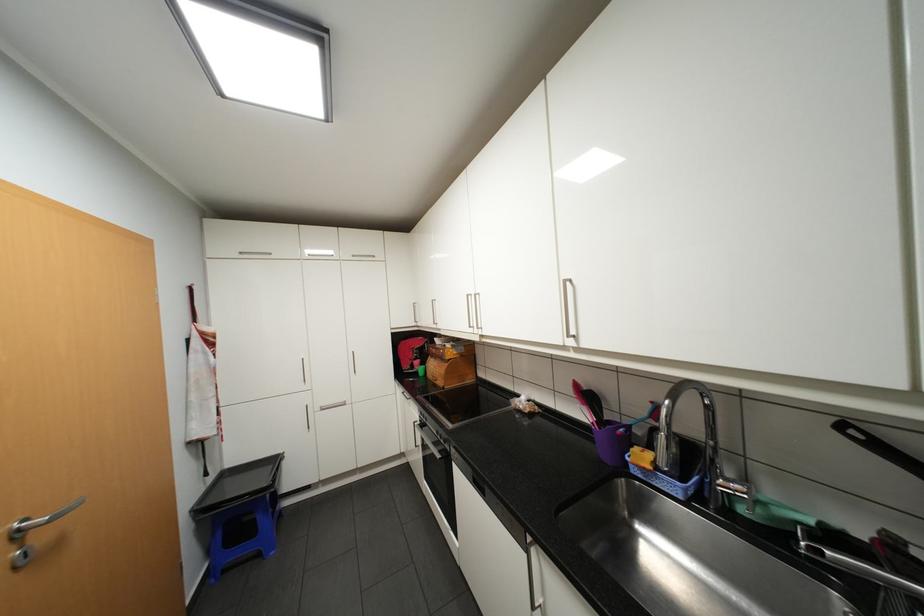
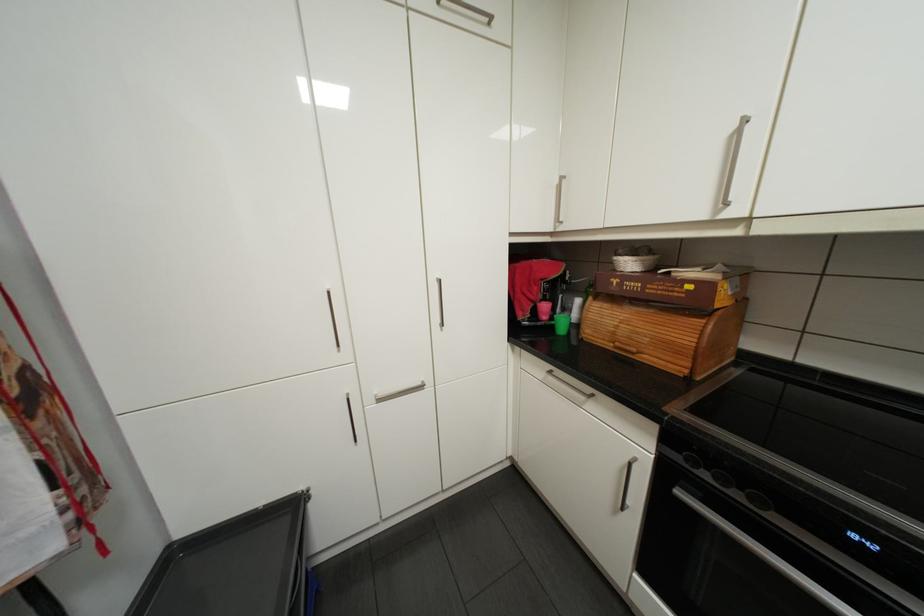
In the second image, find the point that corresponds to (455,357) in the first image.

(725, 305)